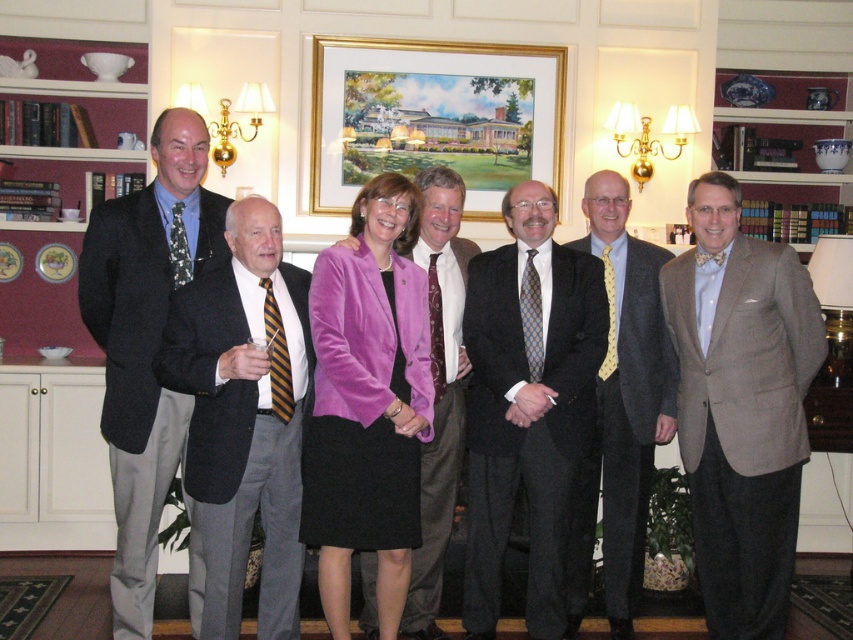
You are standing in the room and want to move from point A to point B. Point A is at coordinate point (335,406) and point B is at coordinate point (610,294). Which point is closer to you when you are facing the framed painting of a house and landscape?

Point A at coordinate point (335,406) is closer to you because it is in front of point B at coordinate point (610,294).

You are a photographer adjusting the camera settings for a group photo. You notice the dark gray suit at left and the yellow striped tie at center. Which person should you focus on first to ensure their height is properly framed?

The dark gray suit at left is much taller than the yellow striped tie at center, so you should focus on the dark gray suit at left first to account for their greater height in the frame.